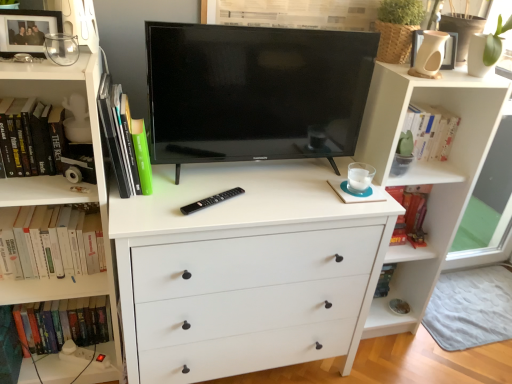
I want to click on empty space that is in between green matte book at left, the 3th book positioned from the bottom, and black glossy tv at center, so click(225, 183).